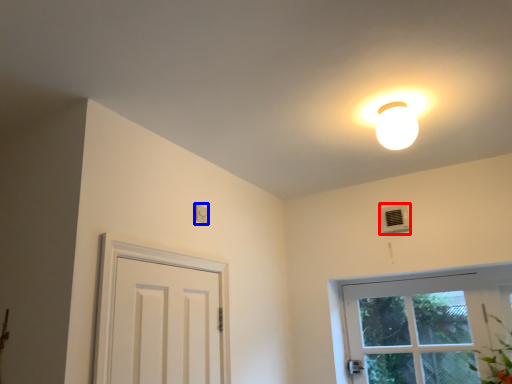
Question: Which of the following is the closest to the observer, air conditioner (highlighted by a red box) or light switch (highlighted by a blue box)?

Choices:
 (A) air conditioner
 (B) light switch

Answer: (B)